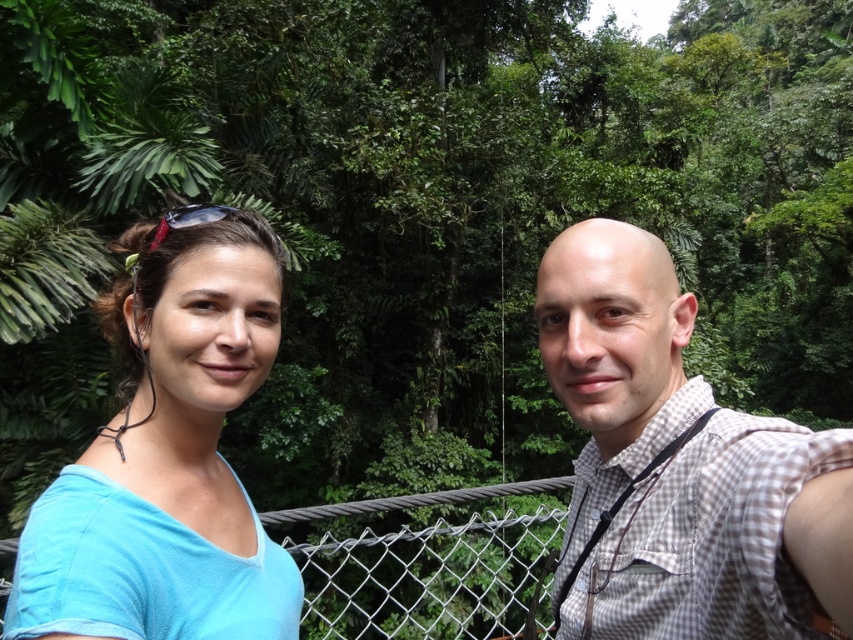
Question: Can you confirm if blue fabric shirt at left is thinner than wire mesh fence at center?

Choices:
 (A) no
 (B) yes

Answer: (B)

Question: Is blue fabric shirt at left to the right of white checkered shirt at center from the viewer's perspective?

Choices:
 (A) yes
 (B) no

Answer: (B)

Question: Which of the following is the closest to the observer?

Choices:
 (A) light blue fabric at left
 (B) white checkered shirt at center
 (C) blue fabric shirt at left

Answer: (B)

Question: Does blue fabric shirt at left have a larger size compared to wire mesh fence at center?

Choices:
 (A) yes
 (B) no

Answer: (B)

Question: Which of these objects is positioned farthest from the white checkered shirt at center?

Choices:
 (A) wire mesh fence at center
 (B) light blue fabric at left
 (C) blue fabric shirt at left

Answer: (A)

Question: Which object is the closest to the wire mesh fence at center?

Choices:
 (A) blue fabric shirt at left
 (B) light blue fabric at left
 (C) white checkered shirt at center

Answer: (B)